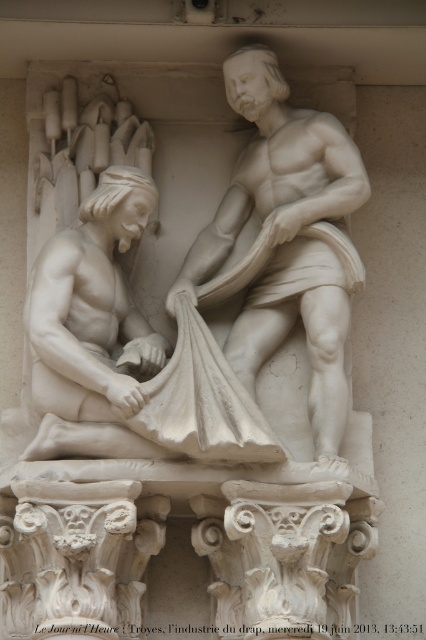
Question: Is white marble man at left wider than white marble statue at center?

Choices:
 (A) no
 (B) yes

Answer: (B)

Question: Is the position of white marble man at left less distant than that of white marble statue at center?

Choices:
 (A) yes
 (B) no

Answer: (A)

Question: Among these objects, which one is nearest to the camera?

Choices:
 (A) white marble statue at center
 (B) white marble man at left

Answer: (B)

Question: Can you confirm if white marble man at left is smaller than white marble statue at center?

Choices:
 (A) no
 (B) yes

Answer: (B)

Question: Which of the following is the farthest from the observer?

Choices:
 (A) white marble man at left
 (B) white marble statue at center

Answer: (B)

Question: Among these objects, which one is nearest to the camera?

Choices:
 (A) white marble man at left
 (B) white marble statue at center

Answer: (A)